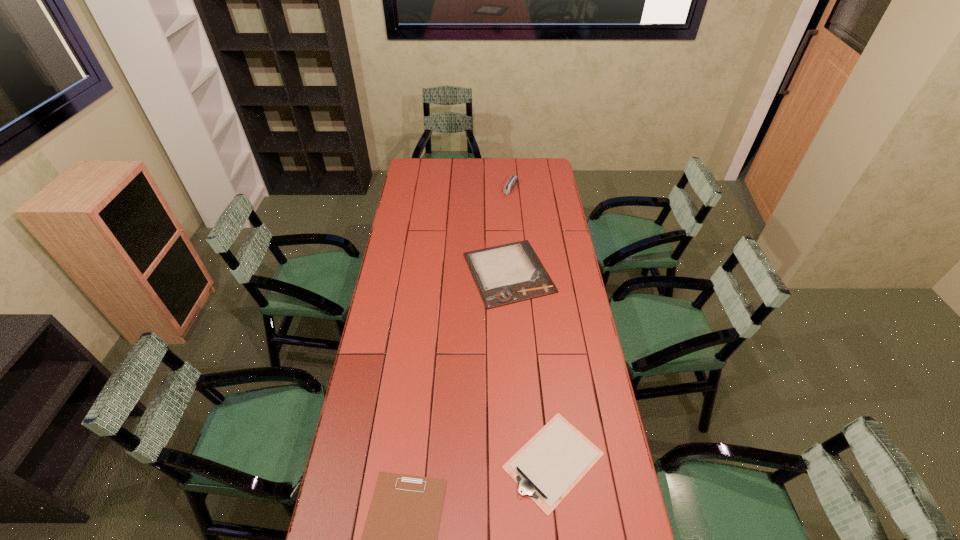
Where is `free spot that satisfies the following two spatial constraints: 1. on the front side of the second shortest clipboard; 2. on the right side of the pencil box`? The width and height of the screenshot is (960, 540). free spot that satisfies the following two spatial constraints: 1. on the front side of the second shortest clipboard; 2. on the right side of the pencil box is located at coordinates (535, 461).